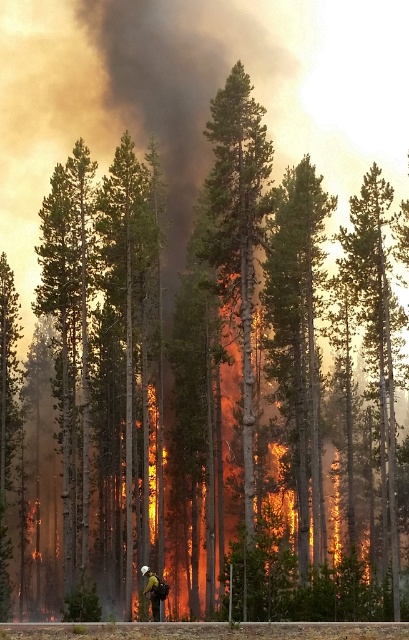
Question: Among these objects, which one is farthest from the camera?

Choices:
 (A) green smooth bark tree at center
 (B) green smooth tree at right
 (C) hard hat helmet at center
 (D) green rough bark tree at center

Answer: (D)

Question: Among these objects, which one is nearest to the camera?

Choices:
 (A) hard hat helmet at center
 (B) green rough bark tree at center

Answer: (A)

Question: Where is green rough bark tree at center located in relation to green smooth tree at right in the image?

Choices:
 (A) right
 (B) left

Answer: (B)

Question: Is green rough bark tree at center behind green smooth tree at right?

Choices:
 (A) no
 (B) yes

Answer: (B)

Question: Which point is closer to the camera?

Choices:
 (A) green smooth bark tree at center
 (B) green rough bark tree at center

Answer: (A)

Question: Can you confirm if green rough bark tree at center is positioned to the right of hard hat helmet at center?

Choices:
 (A) no
 (B) yes

Answer: (B)